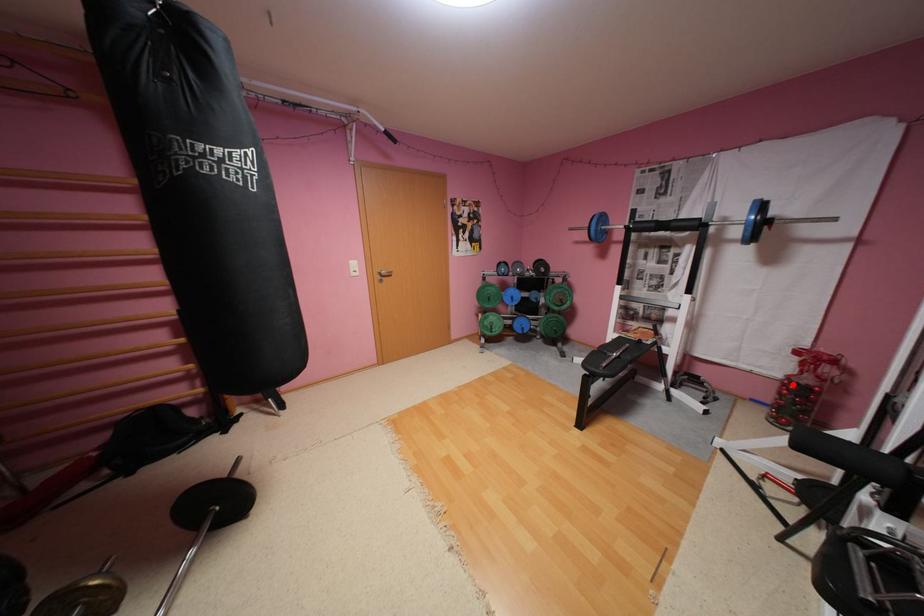
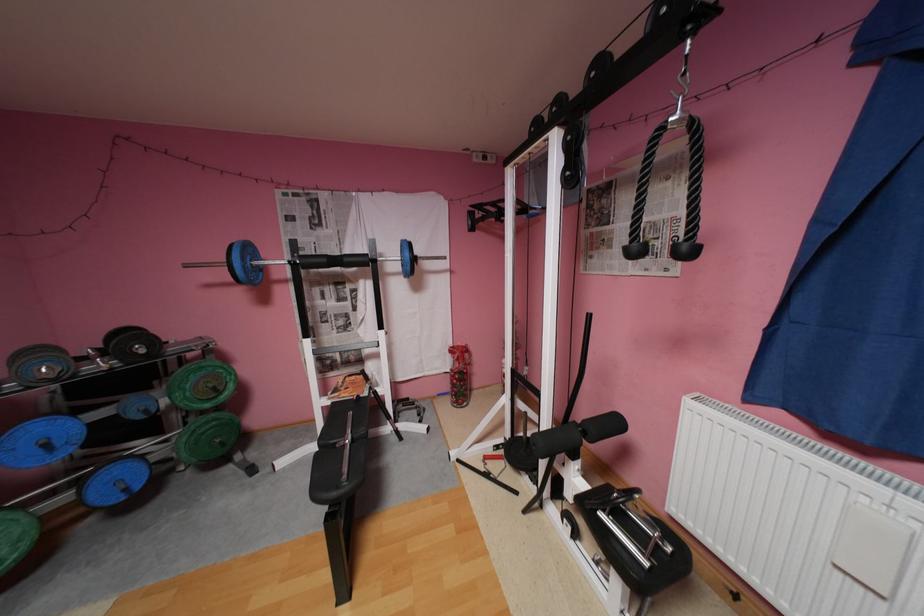
Question: I am providing you with two images of the same scene from different viewpoints. A red point is marked on the first image. Can you still see the location of the red point in image 2?

Choices:
 (A) Yes
 (B) No

Answer: (A)